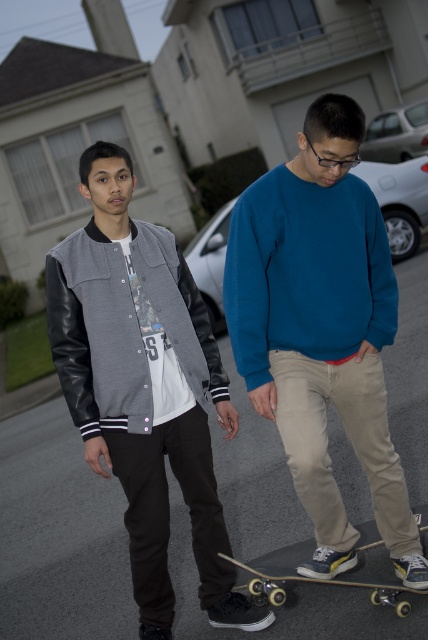
In the image, there are two people wearing different jackets. The first person is wearing a gray fabric jacket at center, and the second person has a blue cotton sweatshirt at center. From the perspective of someone standing in front of them, which jacket is positioned to the right?

The blue cotton sweatshirt at center is to the right of the gray fabric jacket at center.

You are designing a storage compartment for outdoor gear. The gray fabric jacket at center and the wooden skateboard at lower center need to be stored together. Given their sizes, which object should be placed first to optimize space?

The gray fabric jacket at center is larger than the wooden skateboard at lower center, so it should be placed first to optimize space.

You are a fashion designer observing two clothing items in the image. The blue cotton sweatshirt at center and the gray fabric jacket at center. Which clothing item is positioned higher on the person?

The blue cotton sweatshirt at center is positioned higher than the gray fabric jacket at center, so the blue cotton sweatshirt at center is above the gray fabric jacket at center.